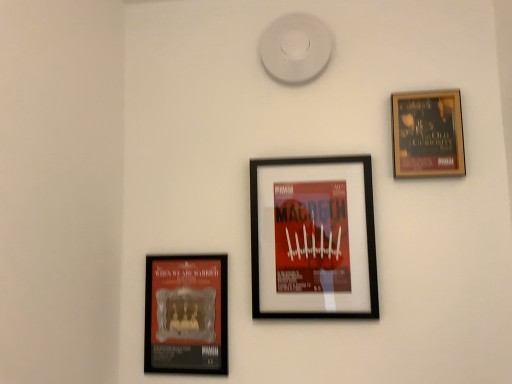
Question: Is wooden framed poster at upper right, which is the 1th picture frame from right to left, facing away from matte black poster at lower left, the 3th picture frame viewed from the right?

Choices:
 (A) no
 (B) yes

Answer: (A)

Question: Is wooden framed poster at upper right, which is the 1th picture frame from right to left, located outside matte black poster at lower left, arranged as the first picture frame when viewed from the left?

Choices:
 (A) yes
 (B) no

Answer: (A)

Question: Considering the relative sizes of wooden framed poster at upper right, which is the 1th picture frame from right to left, and matte black poster at lower left, the 3th picture frame viewed from the right, in the image provided, is wooden framed poster at upper right, which is the 1th picture frame from right to left, bigger than matte black poster at lower left, the 3th picture frame viewed from the right,?

Choices:
 (A) yes
 (B) no

Answer: (B)

Question: Is wooden framed poster at upper right, the third picture frame viewed from the left, aimed at matte black poster at lower left, arranged as the first picture frame when viewed from the left?

Choices:
 (A) no
 (B) yes

Answer: (A)

Question: Can you confirm if wooden framed poster at upper right, which is the 1th picture frame from right to left, is thinner than matte black poster at lower left, the 3th picture frame viewed from the right?

Choices:
 (A) no
 (B) yes

Answer: (A)

Question: Looking at the image, does matte black poster at lower left, the 3th picture frame viewed from the right, seem bigger or smaller compared to black matte picture frame at center, arranged as the second picture frame when viewed from the left?

Choices:
 (A) small
 (B) big

Answer: (A)

Question: From the image's perspective, is matte black poster at lower left, the 3th picture frame viewed from the right, above or below black matte picture frame at center, arranged as the second picture frame when viewed from the left?

Choices:
 (A) below
 (B) above

Answer: (A)

Question: In the image, is matte black poster at lower left, the 3th picture frame viewed from the right, on the left side or the right side of black matte picture frame at center, arranged as the second picture frame when viewed from the left?

Choices:
 (A) left
 (B) right

Answer: (A)

Question: Is matte black poster at lower left, arranged as the first picture frame when viewed from the left, wider or thinner than black matte picture frame at center, arranged as the second picture frame when viewed from the left?

Choices:
 (A) thin
 (B) wide

Answer: (A)

Question: From a real-world perspective, is wooden framed poster at upper right, which is the 1th picture frame from right to left, physically located above or below matte black poster at lower left, arranged as the first picture frame when viewed from the left?

Choices:
 (A) below
 (B) above

Answer: (B)

Question: Considering the positions of point (421, 96) and point (178, 329), is point (421, 96) closer or farther from the camera than point (178, 329)?

Choices:
 (A) closer
 (B) farther

Answer: (A)

Question: From the image's perspective, is wooden framed poster at upper right, which is the 1th picture frame from right to left, located above or below matte black poster at lower left, arranged as the first picture frame when viewed from the left?

Choices:
 (A) below
 (B) above

Answer: (B)

Question: Would you say wooden framed poster at upper right, the third picture frame viewed from the left, is to the left or to the right of matte black poster at lower left, arranged as the first picture frame when viewed from the left, in the picture?

Choices:
 (A) right
 (B) left

Answer: (A)

Question: Would you say matte black poster at lower left, the 3th picture frame viewed from the right, is inside or outside wooden framed poster at upper right, which is the 1th picture frame from right to left?

Choices:
 (A) inside
 (B) outside

Answer: (B)

Question: Visually, is matte black poster at lower left, the 3th picture frame viewed from the right, positioned to the left or to the right of wooden framed poster at upper right, the third picture frame viewed from the left?

Choices:
 (A) right
 (B) left

Answer: (B)